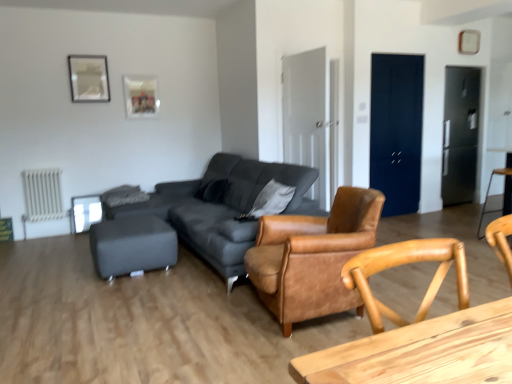
The image size is (512, 384). I want to click on unoccupied area in front of matte black couch at center, so click(163, 328).